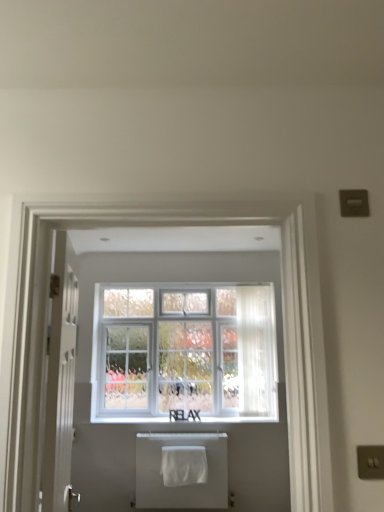
Question: Can you confirm if white fabric bath towel at lower center, which ranks as the first bath towel in front-to-back order, is thinner than white matte window sill at center?

Choices:
 (A) no
 (B) yes

Answer: (B)

Question: Considering the relative sizes of white fabric bath towel at lower center, which is the second bath towel in back-to-front order, and white matte window sill at center in the image provided, is white fabric bath towel at lower center, which is the second bath towel in back-to-front order, taller than white matte window sill at center?

Choices:
 (A) no
 (B) yes

Answer: (B)

Question: From a real-world perspective, is white fabric bath towel at lower center, which is the second bath towel in back-to-front order, physically below white matte window sill at center?

Choices:
 (A) no
 (B) yes

Answer: (B)

Question: Is the surface of white fabric bath towel at lower center, which ranks as the first bath towel in front-to-back order, in direct contact with white matte window sill at center?

Choices:
 (A) yes
 (B) no

Answer: (B)

Question: Are white fabric bath towel at lower center, which ranks as the first bath towel in front-to-back order, and white matte window sill at center far apart?

Choices:
 (A) no
 (B) yes

Answer: (A)

Question: From a real-world perspective, is white matte window sill at center physically located above or below white textured window at center?

Choices:
 (A) above
 (B) below

Answer: (B)

Question: Is white matte window sill at center to the left or to the right of white textured window at center in the image?

Choices:
 (A) left
 (B) right

Answer: (B)

Question: In terms of width, does white matte window sill at center look wider or thinner when compared to white textured window at center?

Choices:
 (A) thin
 (B) wide

Answer: (A)

Question: Is white matte window sill at center in front of or behind white textured window at center in the image?

Choices:
 (A) front
 (B) behind

Answer: (A)

Question: Considering the positions of white cotton bath towel at lower center, the 2th bath towel in the front-to-back sequence, and white glossy door at left in the image, is white cotton bath towel at lower center, the 2th bath towel in the front-to-back sequence, taller or shorter than white glossy door at left?

Choices:
 (A) short
 (B) tall

Answer: (A)

Question: Is white cotton bath towel at lower center, the 2th bath towel in the front-to-back sequence, bigger or smaller than white glossy door at left?

Choices:
 (A) big
 (B) small

Answer: (B)

Question: From the image's perspective, is white cotton bath towel at lower center, which is counted as the first bath towel, starting from the back, located above or below white glossy door at left?

Choices:
 (A) below
 (B) above

Answer: (A)

Question: Is white cotton bath towel at lower center, which is counted as the first bath towel, starting from the back, wider or thinner than white glossy door at left?

Choices:
 (A) wide
 (B) thin

Answer: (A)

Question: From a real-world perspective, is white matte window sill at center above or below white fabric bath towel at lower center, which is the second bath towel in back-to-front order?

Choices:
 (A) above
 (B) below

Answer: (A)

Question: Is white matte window sill at center in front of or behind white fabric bath towel at lower center, which ranks as the first bath towel in front-to-back order, in the image?

Choices:
 (A) behind
 (B) front

Answer: (A)